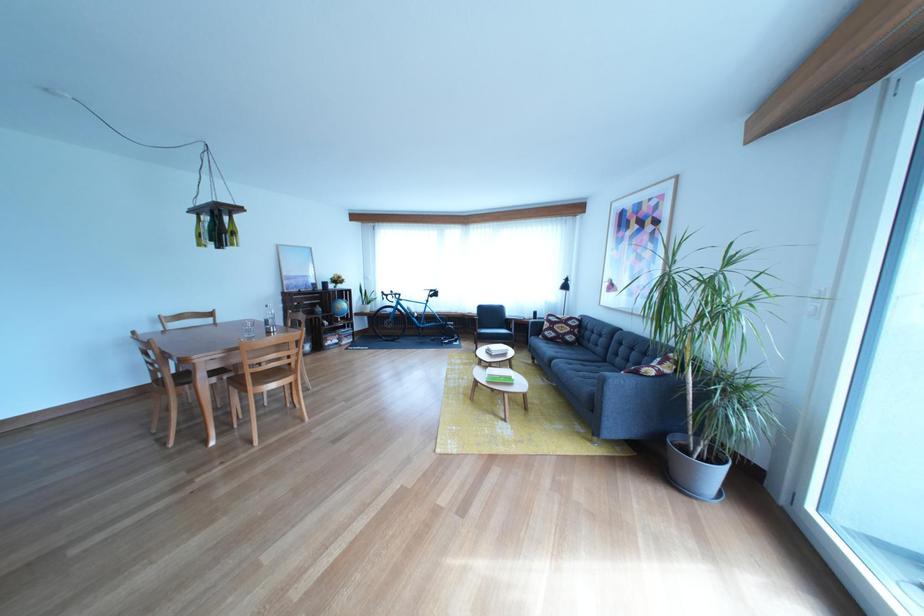
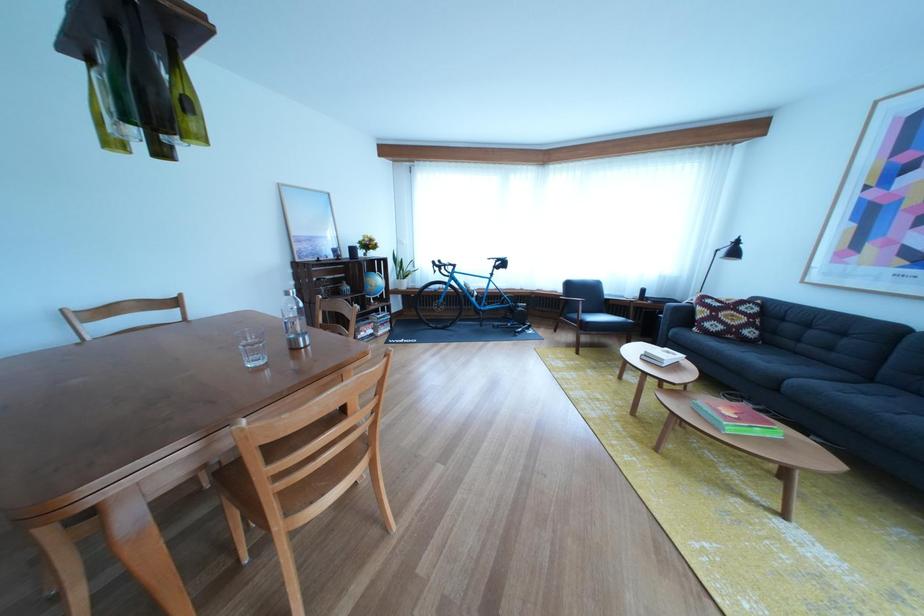
The point at [337,318] is marked in the first image. Where is the corresponding point in the second image?

(367, 297)